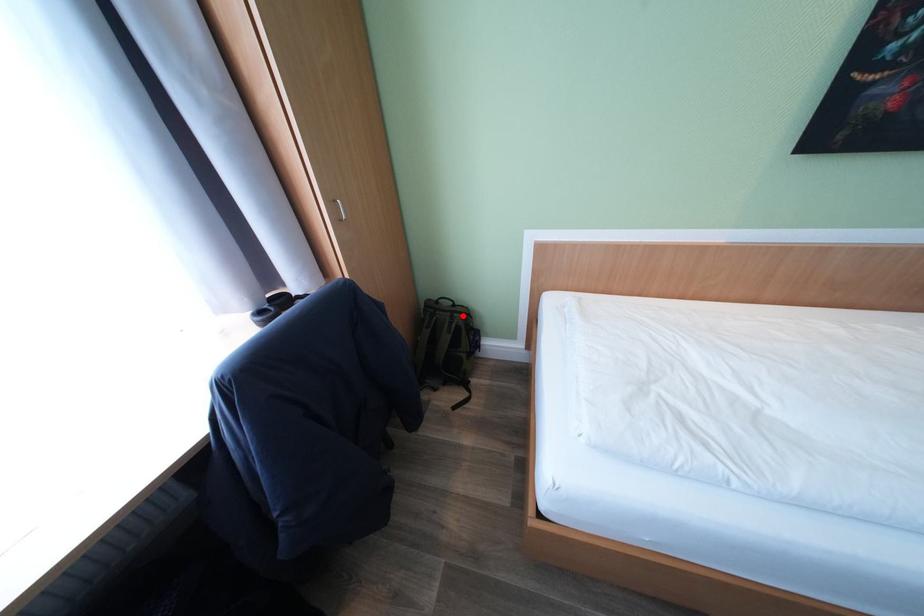
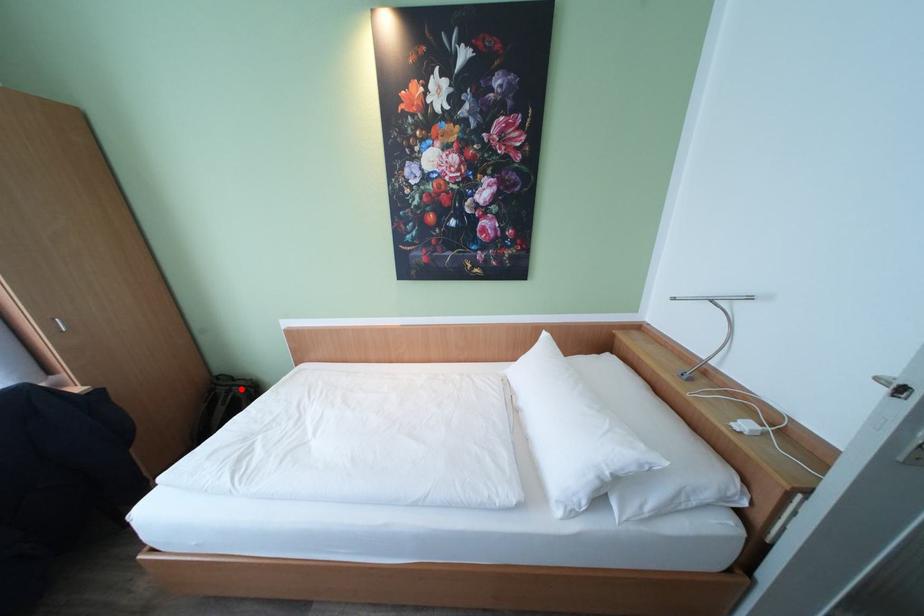
I am providing you with two images of the same scene from different viewpoints. A red point is marked on the first image and another point is marked on the second image. Are the points marked in image1 and image2 representing the same 3D position?

Yes